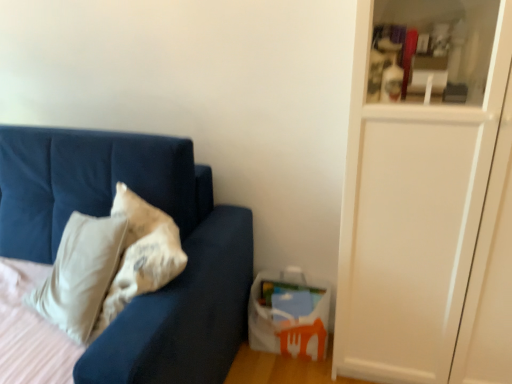
This screenshot has width=512, height=384. What do you see at coordinates (411, 220) in the screenshot?
I see `transparent glass cabinet at right` at bounding box center [411, 220].

Measure the distance between transparent glass cabinet at right and camera.

They are 98.27 centimeters apart.

You are a GUI agent. You are given a task and a screenshot of the screen. Output one action in this format:
    pyautogui.click(x=<x>, y=<y>)
    Task: Click on the transparent glass cabinet at right
    
    Given the screenshot: What is the action you would take?
    pyautogui.click(x=411, y=220)

At what (x,y) coordinates should I click in order to perform the action: click on velvet blue couch at left. Please return your answer as a coordinate pair (x, y). The image size is (512, 384). Looking at the image, I should click on (106, 215).

Describe the element at coordinates (106, 215) in the screenshot. I see `velvet blue couch at left` at that location.

Find the location of a particular element. This screenshot has height=384, width=512. transparent glass cabinet at right is located at coordinates (411, 220).

Is velvet blue couch at left at the left side of transparent glass cabinet at right?

Correct, you'll find velvet blue couch at left to the left of transparent glass cabinet at right.

Is the depth of velvet blue couch at left less than that of transparent glass cabinet at right?

Yes, velvet blue couch at left is in front of transparent glass cabinet at right.

Considering the points (231, 265) and (433, 278), which point is behind, point (231, 265) or point (433, 278)?

Positioned behind is point (231, 265).

From the image's perspective, does velvet blue couch at left appear lower than transparent glass cabinet at right?

Yes, from the image's perspective, velvet blue couch at left is beneath transparent glass cabinet at right.

From a real-world perspective, does velvet blue couch at left stand above transparent glass cabinet at right?

No, from a real-world perspective, velvet blue couch at left is not on top of transparent glass cabinet at right.

Can you confirm if velvet blue couch at left is thinner than transparent glass cabinet at right?

In fact, velvet blue couch at left might be wider than transparent glass cabinet at right.

Between velvet blue couch at left and transparent glass cabinet at right, which one has more height?

transparent glass cabinet at right is taller.

Considering the sizes of objects velvet blue couch at left and transparent glass cabinet at right in the image provided, who is smaller, velvet blue couch at left or transparent glass cabinet at right?

transparent glass cabinet at right is smaller.

Do you think velvet blue couch at left is within transparent glass cabinet at right, or outside of it?

velvet blue couch at left is spatially situated outside transparent glass cabinet at right.

Would you say velvet blue couch at left is a long distance from transparent glass cabinet at right?

No, velvet blue couch at left is in close proximity to transparent glass cabinet at right.

Is velvet blue couch at left facing away from transparent glass cabinet at right?

That's not correct — velvet blue couch at left is not looking away from transparent glass cabinet at right.

What's the angular difference between velvet blue couch at left and transparent glass cabinet at right's facing directions?

The facing directions of velvet blue couch at left and transparent glass cabinet at right are 3.42 degrees apart.

How far apart are velvet blue couch at left and transparent glass cabinet at right?

They are 26.50 inches apart.

Locate an element on the screen. Image resolution: width=512 pixels, height=384 pixels. studio couch directly beneath the transparent glass cabinet at right (from a real-world perspective) is located at coordinates (106, 215).

Can you confirm if transparent glass cabinet at right is positioned to the left of velvet blue couch at left?

No.

Which object is further away from the camera, transparent glass cabinet at right or velvet blue couch at left?

transparent glass cabinet at right is further away from the camera.

Is point (366, 30) less distant than point (56, 243)?

Yes, it is.

Consider the image. From the image's perspective, which is below, transparent glass cabinet at right or velvet blue couch at left?

velvet blue couch at left.

From a real-world perspective, relative to velvet blue couch at left, is transparent glass cabinet at right vertically above or below?

transparent glass cabinet at right is situated higher than velvet blue couch at left in the real world.

Considering the relative sizes of transparent glass cabinet at right and velvet blue couch at left in the image provided, is transparent glass cabinet at right thinner than velvet blue couch at left?

Indeed, transparent glass cabinet at right has a lesser width compared to velvet blue couch at left.

Considering the sizes of objects transparent glass cabinet at right and velvet blue couch at left in the image provided, who is shorter, transparent glass cabinet at right or velvet blue couch at left?

With less height is velvet blue couch at left.

Considering the sizes of transparent glass cabinet at right and velvet blue couch at left in the image, is transparent glass cabinet at right bigger or smaller than velvet blue couch at left?

Considering their sizes, transparent glass cabinet at right takes up less space than velvet blue couch at left.

Would you say transparent glass cabinet at right is outside velvet blue couch at left?

Yes, transparent glass cabinet at right is not within velvet blue couch at left.

Are transparent glass cabinet at right and velvet blue couch at left located far from each other?

No, transparent glass cabinet at right is not far from velvet blue couch at left.

Is transparent glass cabinet at right aimed at velvet blue couch at left?

No, transparent glass cabinet at right is not facing towards velvet blue couch at left.

There is a velvet blue couch at left. Identify the location of glass door above it (from a real-world perspective). The image size is (512, 384). (411, 220).

Where is `glass door located on the right of velvet blue couch at left`? The height and width of the screenshot is (384, 512). glass door located on the right of velvet blue couch at left is located at coordinates pos(411,220).

The image size is (512, 384). In the image, there is a transparent glass cabinet at right. In order to click on studio couch below it (from the image's perspective) in this screenshot , I will do `click(106, 215)`.